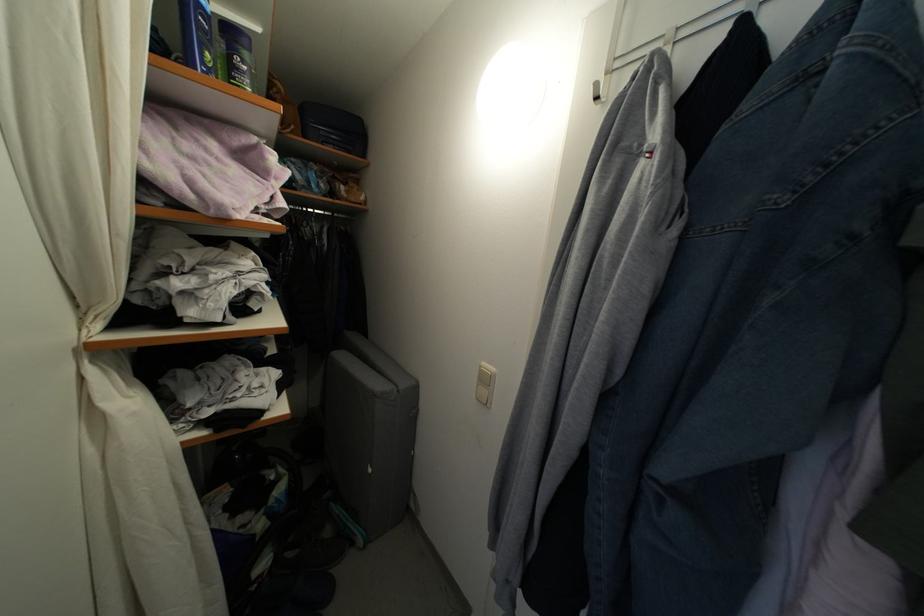
Describe the element at coordinates (484, 384) in the screenshot. I see `a white switch button` at that location.